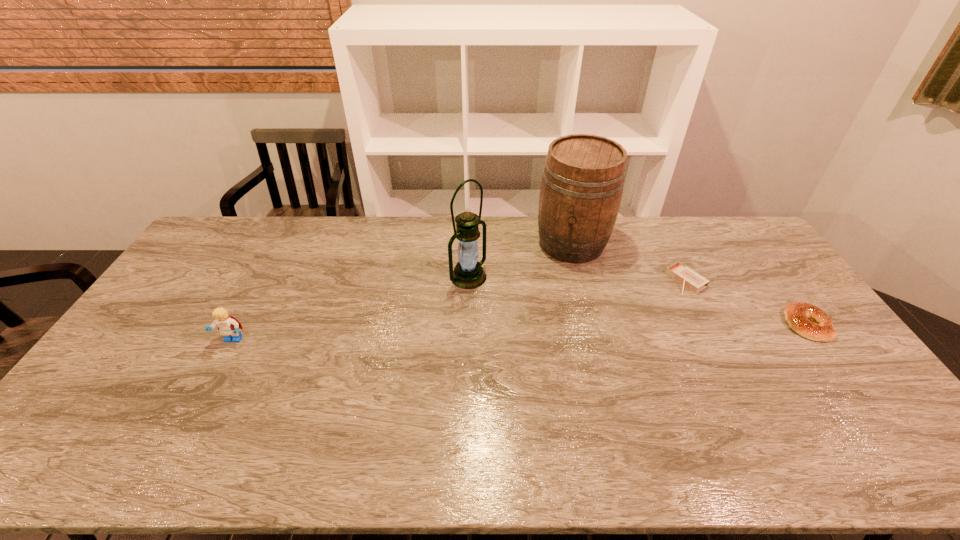
In the image, there is a desktop. Where is `vacant space at the near edge`? Image resolution: width=960 pixels, height=540 pixels. vacant space at the near edge is located at coordinates (238, 411).

This screenshot has height=540, width=960. Identify the location of free space at the left edge of the desktop. (228, 258).

In the image, there is a desktop. Identify the location of vacant space at the far right corner. The image size is (960, 540). (702, 218).

Image resolution: width=960 pixels, height=540 pixels. In order to click on free space between the cider and the matchbox in this screenshot , I will do point(629,262).

You are a GUI agent. You are given a task and a screenshot of the screen. Output one action in this format:
    pyautogui.click(x=<x>, y=<y>)
    Task: Click on the vacant point located between the rightmost object and the Lego
    The width and height of the screenshot is (960, 540).
    Given the screenshot: What is the action you would take?
    pyautogui.click(x=519, y=333)

Locate an element on the screen. free space between the leftmost object and the second object from left to right is located at coordinates point(350,309).

Locate an element on the screen. free space between the second object from left to right and the cider is located at coordinates (520, 260).

At what (x,y) coordinates should I click in order to perform the action: click on vacant space that is in between the rightmost object and the second object from right to left. Please return your answer as a coordinate pair (x, y). This screenshot has height=540, width=960. Looking at the image, I should click on (746, 302).

The height and width of the screenshot is (540, 960). In order to click on vacant area that lies between the cider and the matchbox in this screenshot , I will do `click(629, 262)`.

Locate an element on the screen. free point between the rightmost object and the Lego is located at coordinates (519, 333).